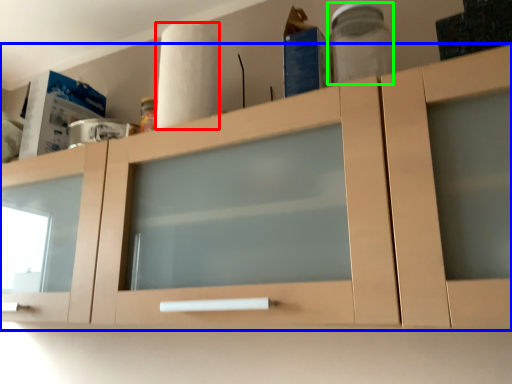
Question: Which is nearer to the paper towel (highlighted by a red box)? cabinetry (highlighted by a blue box) or glass jar (highlighted by a green box).

Choices:
 (A) cabinetry
 (B) glass jar

Answer: (A)